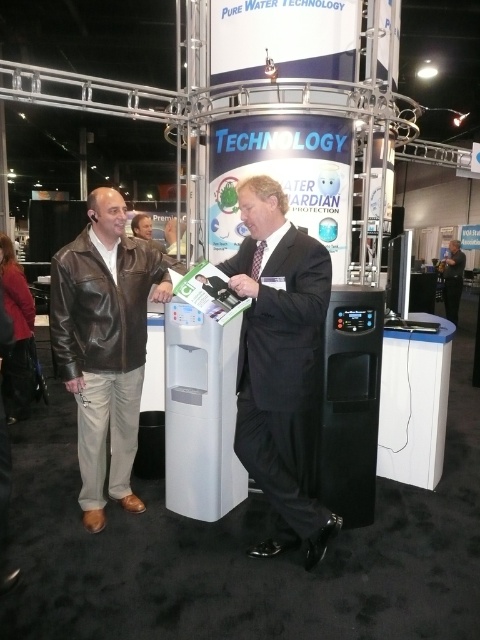
In the scene shown: Is black suit at center positioned in front of dark suit at center?

That is True.

Is point (263, 429) more distant than point (456, 296)?

No, it is not.

Does point (276, 237) come in front of point (463, 272)?

Yes, it is in front of point (463, 272).

The image size is (480, 640). In order to click on black suit at center in this screenshot , I will do [280, 364].

Between brown leather jacket at left and leather jacket at center, which one is positioned lower?

brown leather jacket at left

Does brown leather jacket at left appear over leather jacket at center?

No, brown leather jacket at left is not above leather jacket at center.

Describe the element at coordinates (105, 342) in the screenshot. I see `brown leather jacket at left` at that location.

What are the coordinates of `brown leather jacket at left` in the screenshot? It's located at (105, 342).

Is point (446, 260) farther from camera compared to point (140, 212)?

No, (446, 260) is in front of (140, 212).

Is dark suit at center to the left of leather jacket at center from the viewer's perspective?

No, dark suit at center is not to the left of leather jacket at center.

Locate an element on the screen. This screenshot has height=640, width=480. dark suit at center is located at coordinates (453, 278).

You are a GUI agent. You are given a task and a screenshot of the screen. Output one action in this format:
    pyautogui.click(x=<x>, y=<y>)
    Task: Click on the dark suit at center
    This screenshot has width=480, height=640.
    Given the screenshot: What is the action you would take?
    pyautogui.click(x=453, y=278)